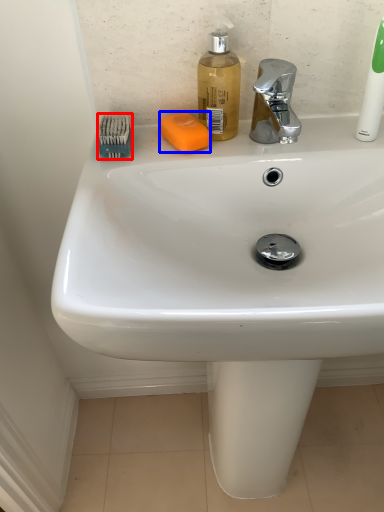
Question: Which point is closer to the camera, brush (highlighted by a red box) or soap (highlighted by a blue box)?

Choices:
 (A) brush
 (B) soap

Answer: (A)